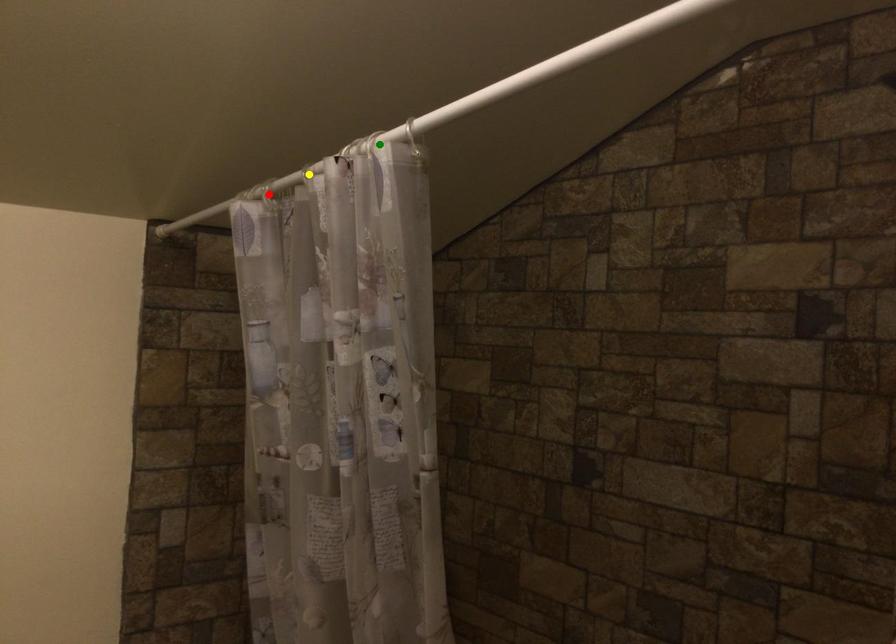
Order these from nearest to farthest:
red point | green point | yellow point

green point < yellow point < red point